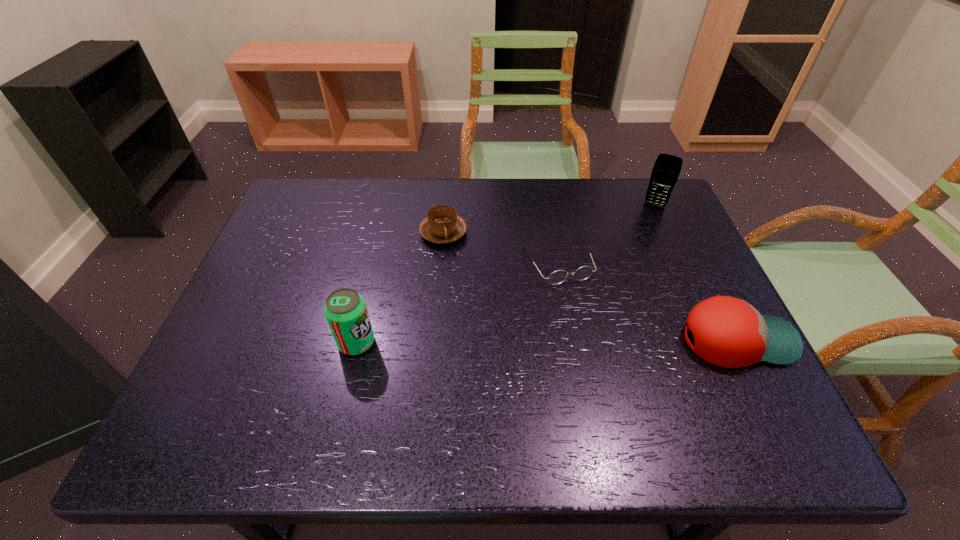
Image resolution: width=960 pixels, height=540 pixels. Find the location of `object positioned at the near edge`. object positioned at the near edge is located at coordinates (728, 332).

This screenshot has width=960, height=540. Identify the location of baseball cap at the right edge. (728, 332).

In order to click on cellular telephone positioned at the right edge in this screenshot , I will do click(x=666, y=170).

I want to click on object that is at the far right corner, so click(x=666, y=170).

Find the location of a particular element. The height and width of the screenshot is (540, 960). object at the near right corner is located at coordinates (728, 332).

In the image, there is a desktop. Where is `free space at the far edge`? free space at the far edge is located at coordinates (417, 189).

At what (x,y) coordinates should I click in order to perform the action: click on vacant space at the left edge. Please return your answer as a coordinate pair (x, y). The image size is (960, 540). Looking at the image, I should click on (276, 325).

Locate an element on the screen. vacant area at the right edge is located at coordinates (649, 239).

In the image, there is a desktop. At what (x,y) coordinates should I click in order to perform the action: click on free space at the far left corner. Please return your answer as a coordinate pair (x, y). The height and width of the screenshot is (540, 960). Looking at the image, I should click on (328, 202).

Where is `vacant space at the near left corner of the desktop`? Image resolution: width=960 pixels, height=540 pixels. vacant space at the near left corner of the desktop is located at coordinates (277, 369).